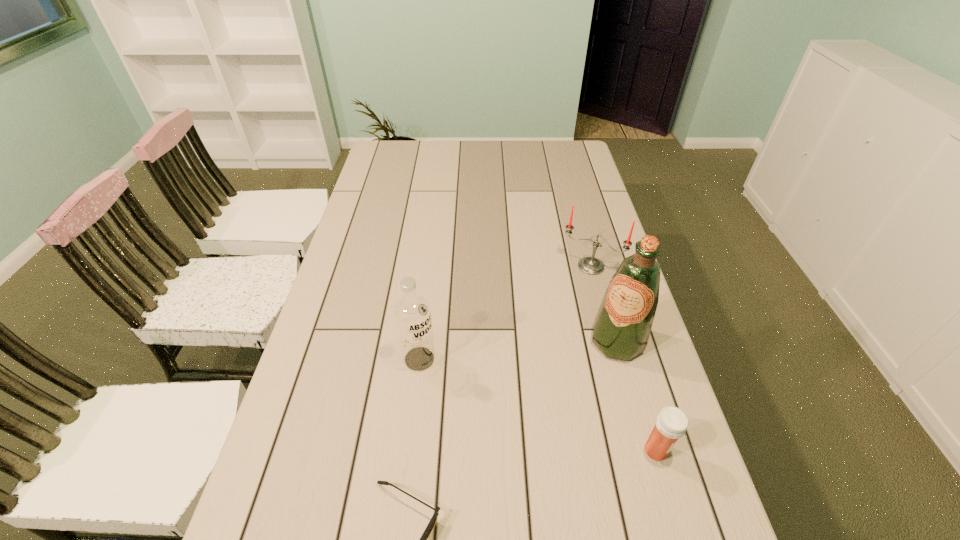
Where is `vacant space on the desktop that is between the sunglasses and the second shortest object and is positioned on the front-facing side of the olive oil`? This screenshot has width=960, height=540. vacant space on the desktop that is between the sunglasses and the second shortest object and is positioned on the front-facing side of the olive oil is located at coordinates (517, 493).

What are the coordinates of `free space on the desktop that is between the sunglasses and the fourth tallest object and is positioned on the front label of the vodka` in the screenshot? It's located at (519, 492).

I want to click on free spot on the desktop that is between the sunglasses and the second shortest object and is positioned on the front-facing side of the farthest object, so click(498, 499).